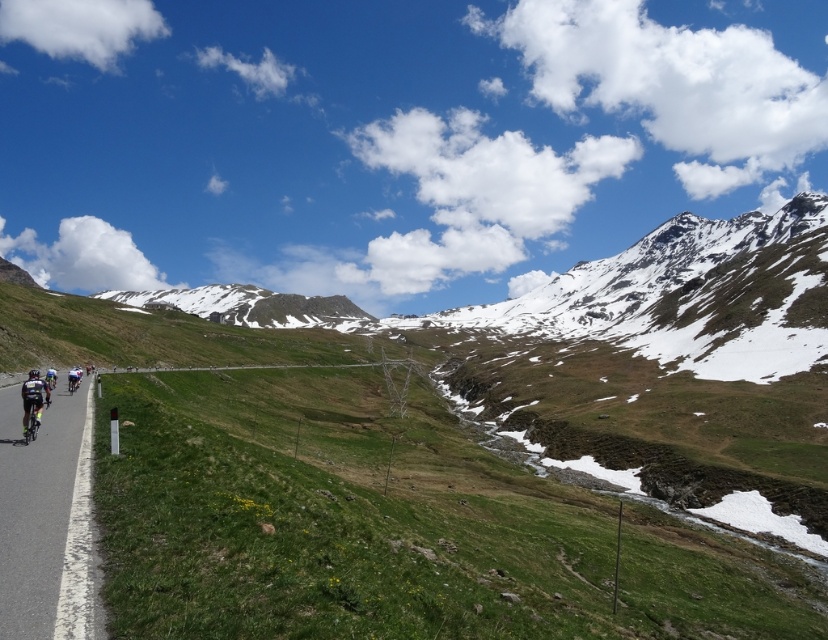
Who is positioned more to the right, shiny black bicycle at left or shiny silver bicycle at left?

Positioned to the right is shiny black bicycle at left.

Is shiny black bicycle at left positioned before shiny silver bicycle at left?

Yes, it is in front of shiny silver bicycle at left.

Is point (29, 410) positioned in front of point (66, 378)?

Yes, it is in front of point (66, 378).

What are the coordinates of `shiny black bicycle at left` in the screenshot? It's located at (31, 417).

This screenshot has height=640, width=828. What do you see at coordinates (47, 522) in the screenshot?
I see `shiny metallic bicycle at left` at bounding box center [47, 522].

The width and height of the screenshot is (828, 640). What are the coordinates of `shiny metallic bicycle at left` in the screenshot? It's located at (47, 522).

Who is more distant from viewer, (357, 308) or (71, 376)?

Positioned behind is point (357, 308).

Does point (152, 305) lie in front of point (70, 381)?

No, it is not.

Where is `snowy rock mountain at upper center`? This screenshot has height=640, width=828. snowy rock mountain at upper center is located at coordinates coord(253,305).

This screenshot has height=640, width=828. I want to click on snowy rock mountain at upper center, so click(253, 305).